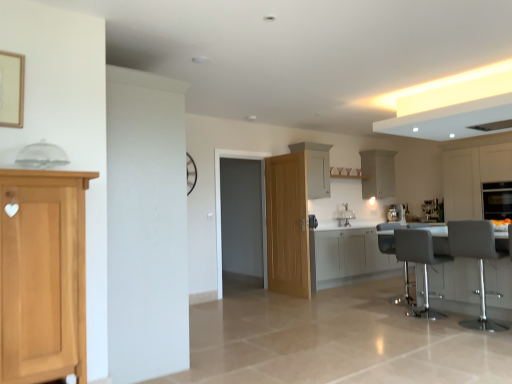
Question: Is metallic gray table at lower right at the left side of matte black oven at right?

Choices:
 (A) no
 (B) yes

Answer: (B)

Question: Can matte black oven at right be found inside metallic gray table at lower right?

Choices:
 (A) no
 (B) yes

Answer: (A)

Question: From the image's perspective, would you say metallic gray table at lower right is shown under matte black oven at right?

Choices:
 (A) yes
 (B) no

Answer: (A)

Question: From the image's perspective, is metallic gray table at lower right above matte black oven at right?

Choices:
 (A) yes
 (B) no

Answer: (B)

Question: Does metallic gray table at lower right have a larger size compared to matte black oven at right?

Choices:
 (A) no
 (B) yes

Answer: (B)

Question: Would you say metallic gray table at lower right is outside matte black oven at right?

Choices:
 (A) no
 (B) yes

Answer: (B)

Question: Is there a large distance between transparent glass door at center and matte black oven at right?

Choices:
 (A) no
 (B) yes

Answer: (B)

Question: Is transparent glass door at center at the right side of matte black oven at right?

Choices:
 (A) no
 (B) yes

Answer: (A)

Question: Is transparent glass door at center directly adjacent to matte black oven at right?

Choices:
 (A) no
 (B) yes

Answer: (A)

Question: Can you confirm if transparent glass door at center is positioned to the left of matte black oven at right?

Choices:
 (A) yes
 (B) no

Answer: (A)

Question: Considering the relative sizes of transparent glass door at center and matte black oven at right in the image provided, is transparent glass door at center wider than matte black oven at right?

Choices:
 (A) no
 (B) yes

Answer: (A)

Question: Could matte black oven at right be considered to be inside transparent glass door at center?

Choices:
 (A) no
 (B) yes

Answer: (A)

Question: Can you confirm if white matte cabinet at upper right, placed as the second cabinetry when sorted from right to left, is wider than satin silver coffee machine at center, which ranks as the 1th coffee machine in left-to-right order?

Choices:
 (A) yes
 (B) no

Answer: (A)